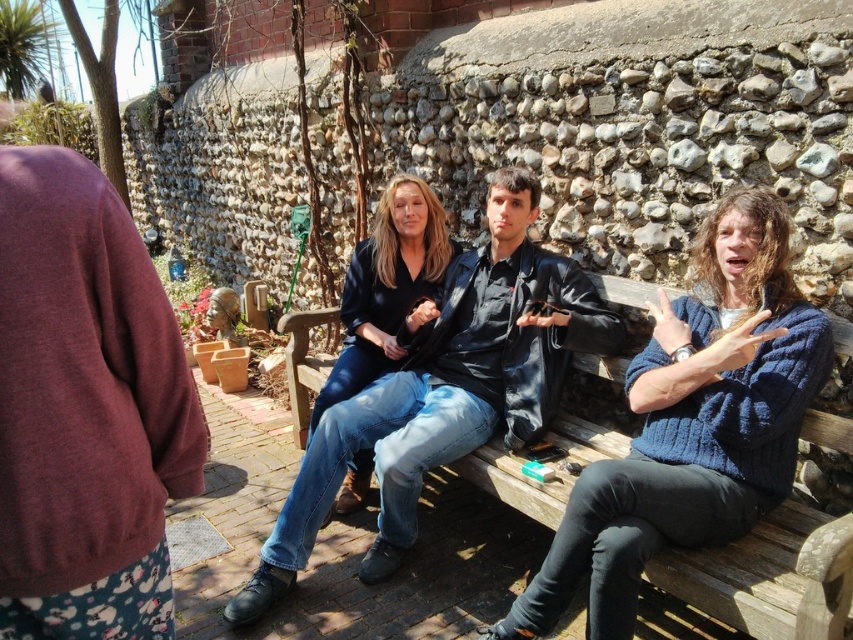
Between knitted blue sweater at center and denim jeans at center, which one appears on the right side from the viewer's perspective?

From the viewer's perspective, knitted blue sweater at center appears more on the right side.

Between point (595, 600) and point (489, 403), which one is positioned in front?

Point (595, 600) is in front.

Where is `knitted blue sweater at center`? knitted blue sweater at center is located at coordinates tap(692, 424).

I want to click on knitted blue sweater at center, so click(692, 424).

Who is taller, denim jeans at center or matte black shirt at center?

denim jeans at center is taller.

Between point (403, 456) and point (337, 356), which one is positioned in front?

Point (403, 456)

Which is behind, point (410, 509) or point (436, 260)?

Point (436, 260)

Identify the location of denim jeans at center. Image resolution: width=853 pixels, height=640 pixels. (445, 388).

Does knitted blue sweater at center appear under matte black shirt at center?

Yes, knitted blue sweater at center is below matte black shirt at center.

At what (x,y) coordinates should I click in order to perform the action: click on knitted blue sweater at center. Please return your answer as a coordinate pair (x, y). Image resolution: width=853 pixels, height=640 pixels. Looking at the image, I should click on (692, 424).